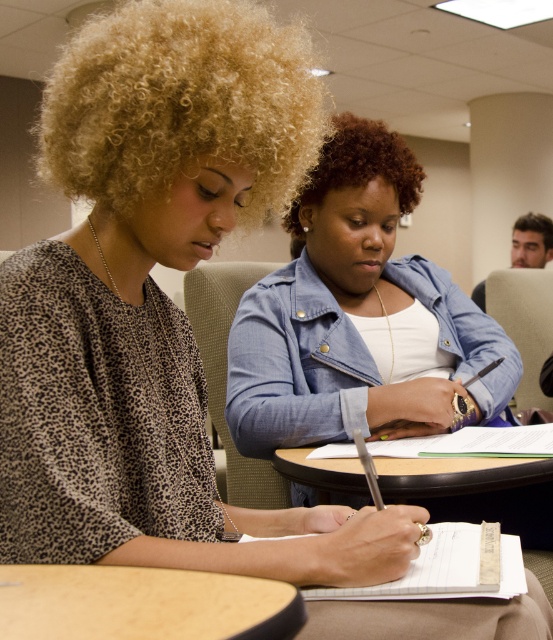
Does leopard print blouse at center have a greater width compared to wooden table at lower left?

Yes.

Who is more distant from viewer, (x=405, y=554) or (x=133, y=611)?

Point (x=405, y=554)

Does point (40, 376) come farther from viewer compared to point (86, 611)?

Yes, it is behind point (86, 611).

At what (x,y) coordinates should I click in order to perform the action: click on leopard print blouse at center. Please return your answer as a coordinate pair (x, y). The image size is (553, 640). Looking at the image, I should click on (156, 301).

At what (x,y) coordinates should I click in order to perform the action: click on leopard print blouse at center. Please return your answer as a coordinate pair (x, y). Looking at the image, I should click on (156, 301).

Can you confirm if leopard print blouse at center is positioned above white lined paper at lower center?

Yes.

Find the location of `leopard print blouse at center`. leopard print blouse at center is located at coordinates (156, 301).

What do you see at coordinates (352, 312) in the screenshot? I see `blue denim jacket at center` at bounding box center [352, 312].

Does blue denim jacket at center come behind white lined paper at lower center?

Yes, blue denim jacket at center is further from the viewer.

This screenshot has width=553, height=640. Describe the element at coordinates (352, 312) in the screenshot. I see `blue denim jacket at center` at that location.

The image size is (553, 640). What are the coordinates of `blue denim jacket at center` in the screenshot? It's located at (x=352, y=312).